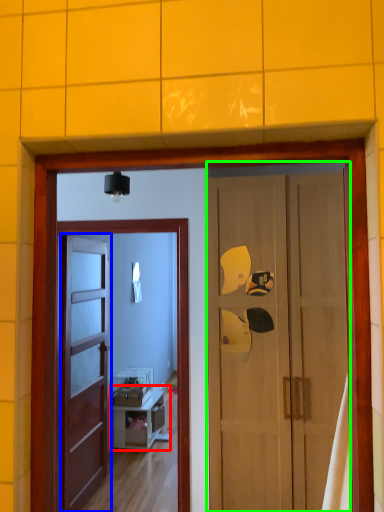
Question: Which object is positioned closest to cabinetry (highlighted by a red box)? Select from door (highlighted by a blue box) and door (highlighted by a green box).

Choices:
 (A) door
 (B) door

Answer: (A)